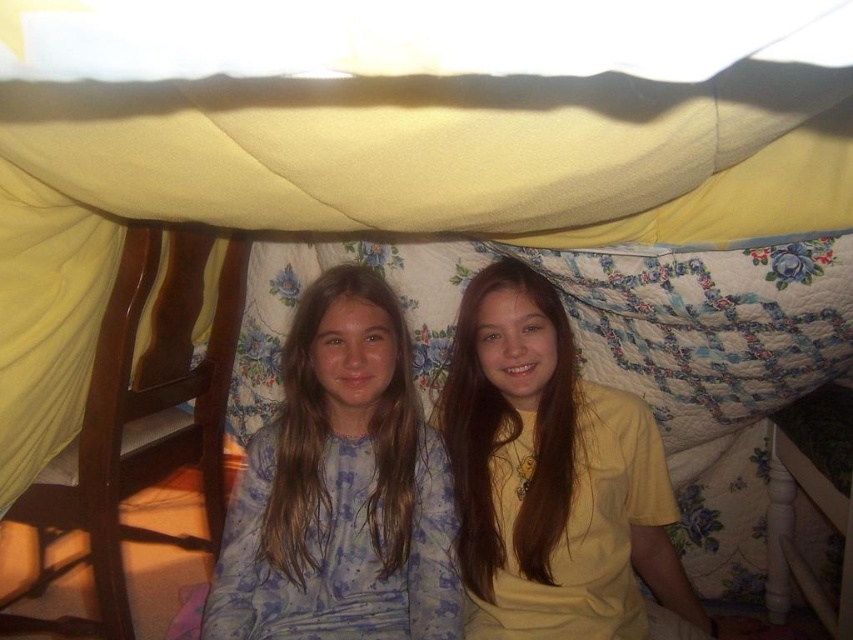
You are standing in front of the tent and want to take a photo of the yellow fabric canopy at upper center with your phone. Your phone has a minimum focus distance of 12 inches. Can you focus on the canopy without moving closer?

The yellow fabric canopy at upper center is 14.89 inches away from the camera, which is beyond the phone camera minimum focus distance of 12 inches. Therefore, you can focus on the yellow fabric canopy at upper center without needing to move closer.